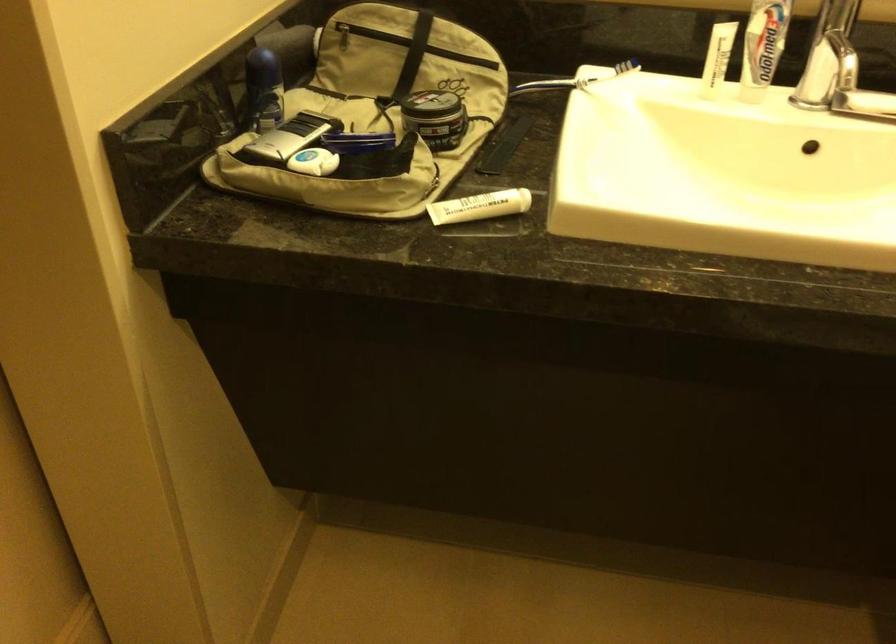
The height and width of the screenshot is (644, 896). I want to click on bag zipper pull, so click(341, 33).